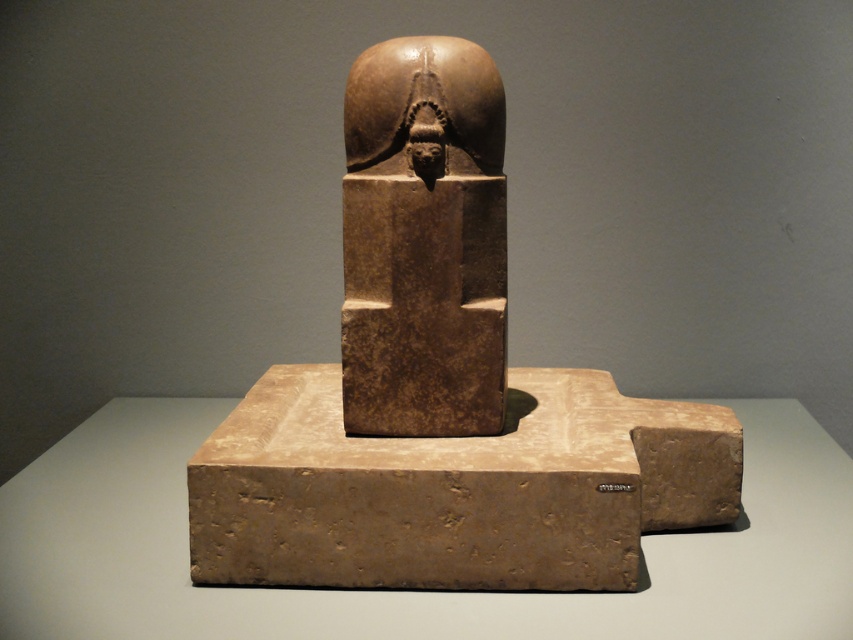
Question: Among these objects, which one is nearest to the camera?

Choices:
 (A) brown stone sculpture at center
 (B) brown stone head at center

Answer: (A)

Question: Which point appears farthest from the camera in this image?

Choices:
 (A) (409, 205)
 (B) (498, 163)
 (C) (585, 417)

Answer: (C)

Question: Can you confirm if brown stone statue at center is positioned below brown stone head at center?

Choices:
 (A) no
 (B) yes

Answer: (B)

Question: Can you confirm if brown stone sculpture at center is positioned to the left of brown stone head at center?

Choices:
 (A) no
 (B) yes

Answer: (A)

Question: Which point appears farthest from the camera in this image?

Choices:
 (A) (393, 67)
 (B) (410, 413)

Answer: (B)

Question: From the image, what is the correct spatial relationship of brown stone statue at center in relation to brown stone head at center?

Choices:
 (A) below
 (B) above

Answer: (A)